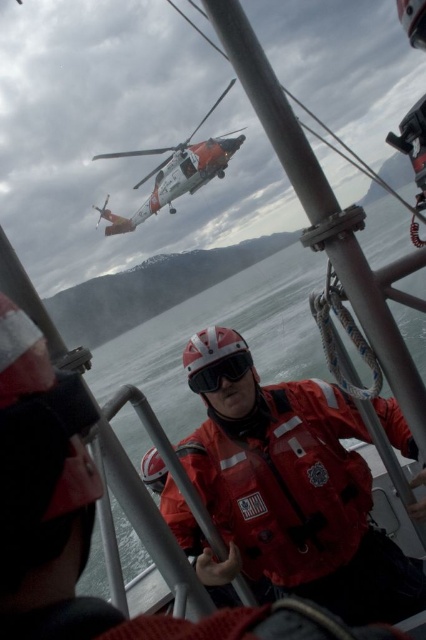
Question: Among these objects, which one is farthest from the camera?

Choices:
 (A) orange matte helicopter at upper center
 (B) red matte life jacket at center
 (C) black matte goggles at center

Answer: (A)

Question: Which of the following is the farthest from the observer?

Choices:
 (A) (146, 148)
 (B) (166, 513)
 (C) (212, 376)

Answer: (A)

Question: Which object is farther from the camera taking this photo?

Choices:
 (A) orange matte helicopter at upper center
 (B) red matte life jacket at center

Answer: (A)

Question: Observing the image, what is the correct spatial positioning of red matte life jacket at center in reference to black matte goggles at center?

Choices:
 (A) below
 (B) above

Answer: (A)

Question: Is red matte life jacket at center further to the viewer compared to orange matte helicopter at upper center?

Choices:
 (A) no
 (B) yes

Answer: (A)

Question: Does red matte life jacket at center appear on the right side of black matte goggles at center?

Choices:
 (A) yes
 (B) no

Answer: (A)